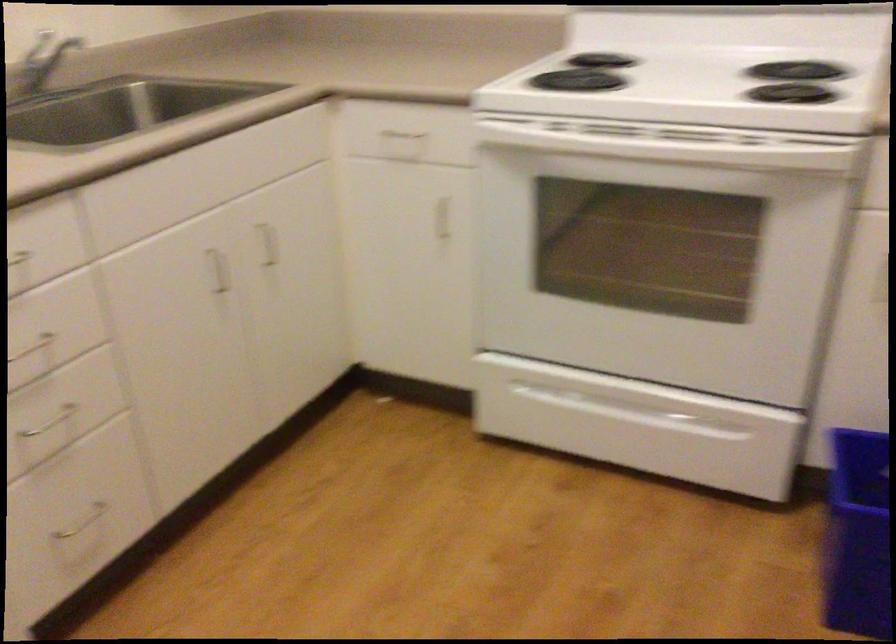
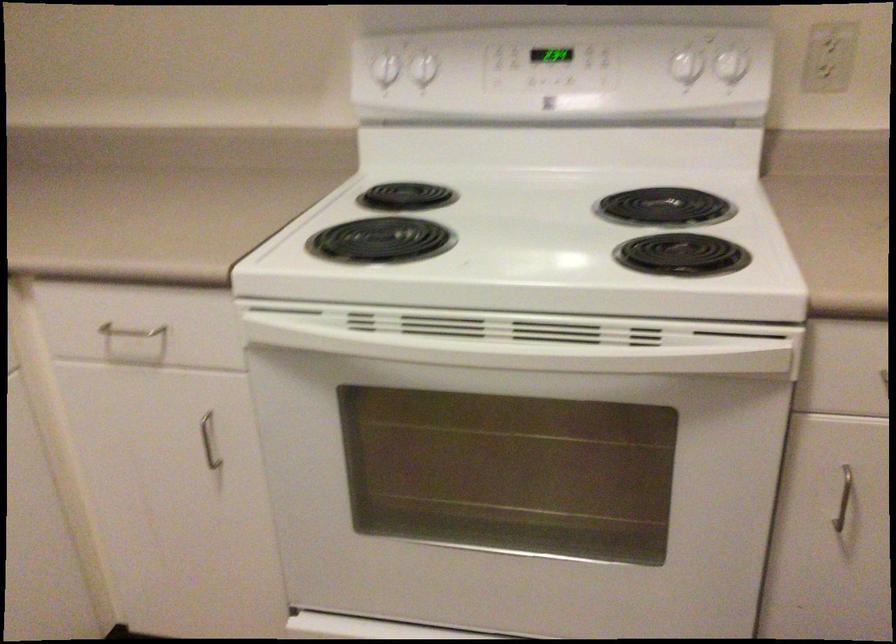
Locate, in the second image, the point that corresponds to the point at 574,82 in the first image.

(380, 240)